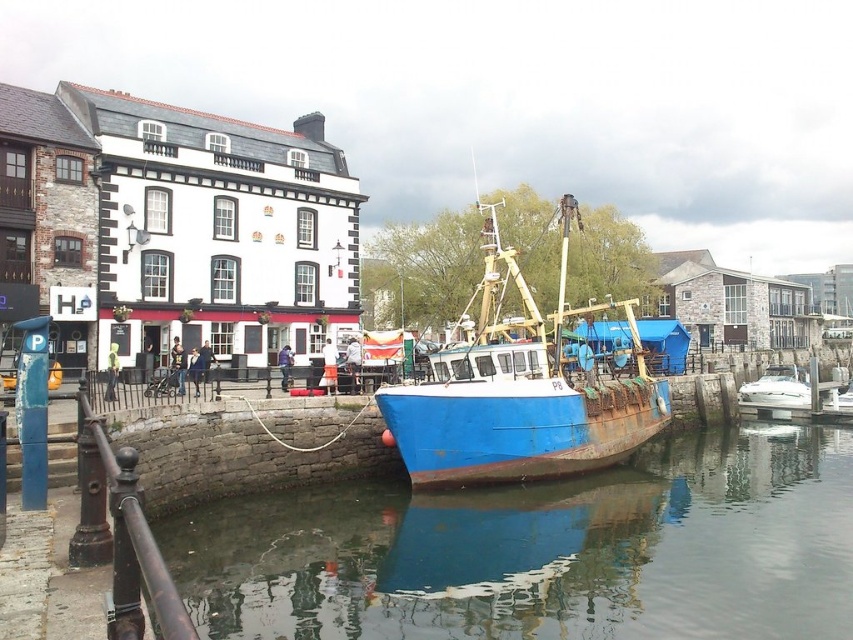
Consider the image. You are a delivery drone with a maximum flight range of 40 meters. You need to deliver a package to the white glossy boat at right from your current position near the blue metallic water at lower center. Can you reach the boat without recharging?

The distance between the blue metallic water at lower center and the white glossy boat at right is 37.12 meters, which is within your 40 meter range. Yes, you can reach the boat without recharging.

You are a visitor standing at the stone pier and want to take a photo of both the rusty blue boat at center and the white glossy boat at right. Which boat should you position yourself closer to in order to include both in the frame without zooming?

You should position yourself closer to the rusty blue boat at center because it is positioned on the left side of the white glossy boat at right, so by moving closer to the rusty blue boat at center, you can capture both boats in the frame without needing to zoom.

You are standing at the stone pier looking out at the blue fishing boat marked P8. You notice two points plotted on a map overlay of the scene. The first point is at coordinates point (x=328, y=554) and the second point is at coordinates point (x=807, y=378). Which of these points is closer to you as you stand on the pier?

Point (x=328, y=554) is closer to you because it is in front of point (x=807, y=378).